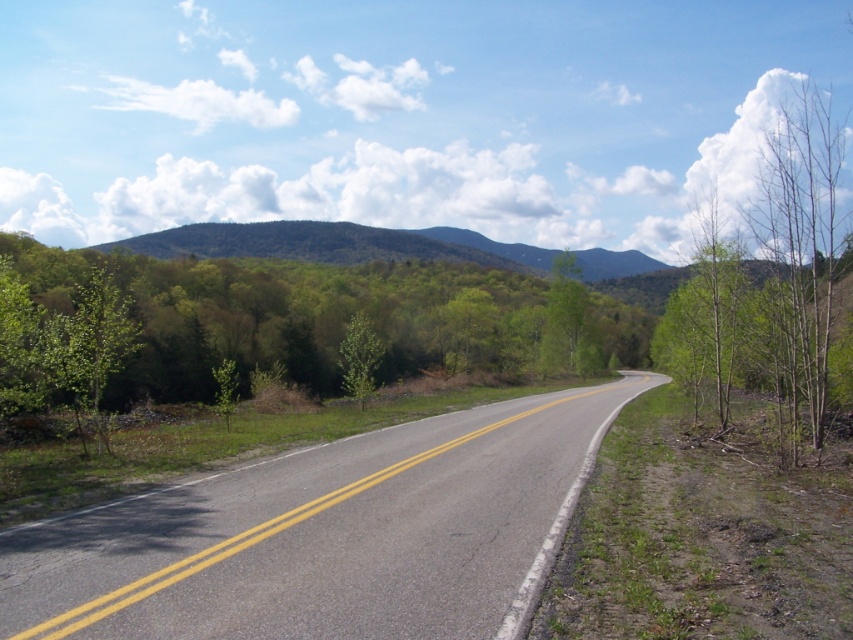
You are a pedestrian standing at the edge of the asphalt road at center. You want to cross to the other side. Which direction should you walk to reach the green matte tree at center first?

The asphalt road at center is below the green matte tree at center, so you should walk forward towards the green matte tree at center to reach it first.

From the picture: You are driving a car and need to stay on the asphalt road at center while avoiding the green matte tree at center. Which side should you steer towards?

The asphalt road at center is positioned on the right side of the green matte tree at center, so you should steer towards the right to stay on the asphalt road at center and avoid the green matte tree at center.

You are driving along the two lane road and see two green leafy trees ahead. The first is the green leafy tree at left and the second is the green leafy tree at center. Which tree is closer to your left side as you drive forward?

The green leafy tree at left is closer to your left side as you drive forward because it is positioned to the left of the green leafy tree at center.